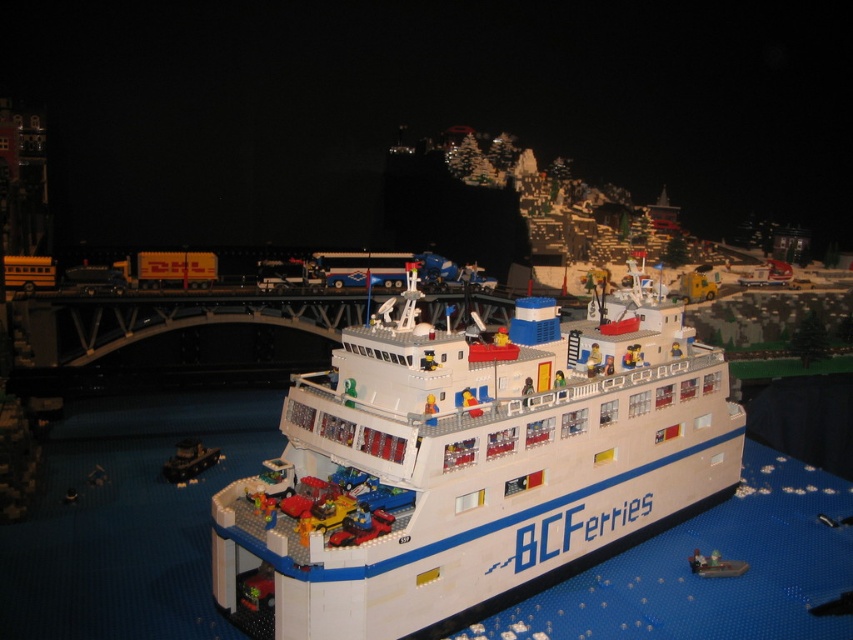
Question: Which object appears closest to the camera in this image?

Choices:
 (A) smooth black boat at lower left
 (B) white plastic boat at center
 (C) white plastic cruise ship at center

Answer: (C)

Question: Which of the following is the farthest from the observer?

Choices:
 (A) (705, 561)
 (B) (183, 477)
 (C) (577, 352)

Answer: (B)

Question: Does smooth black boat at lower left have a larger size compared to white plastic boat at center?

Choices:
 (A) no
 (B) yes

Answer: (B)

Question: Can you confirm if smooth black boat at lower left is positioned above white plastic boat at center?

Choices:
 (A) no
 (B) yes

Answer: (B)

Question: Does white plastic cruise ship at center have a greater width compared to white plastic boat at center?

Choices:
 (A) no
 (B) yes

Answer: (B)

Question: Which point is closer to the camera taking this photo?

Choices:
 (A) (689, 556)
 (B) (177, 472)
 (C) (231, 576)

Answer: (C)